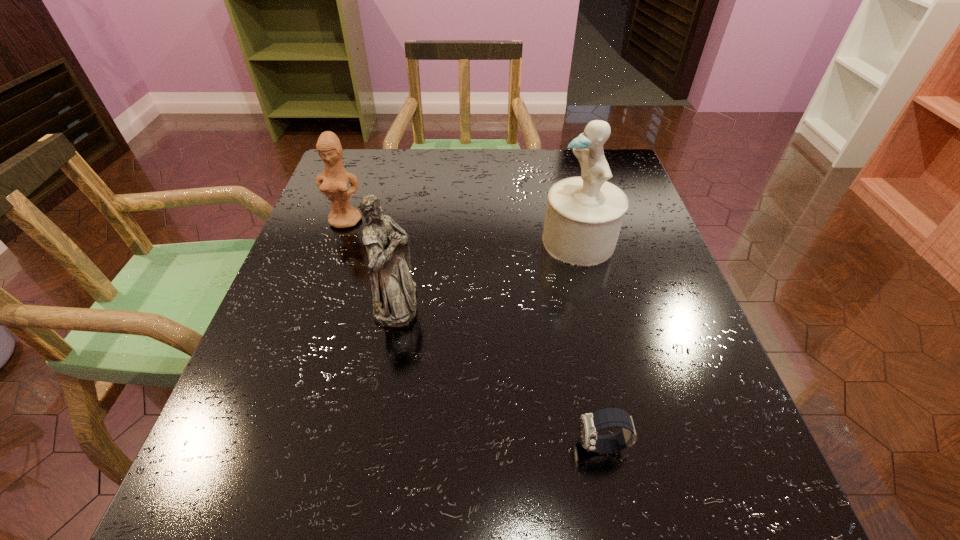
Image resolution: width=960 pixels, height=540 pixels. Identify the location of vacant space at the right edge. point(669,330).

The height and width of the screenshot is (540, 960). Identify the location of free space at the far left corner of the desktop. (360, 158).

This screenshot has height=540, width=960. Identify the location of vacant position at the near left corner of the desktop. (189, 535).

Identify the location of free space at the far right corner of the desktop. (633, 191).

You are a GUI agent. You are given a task and a screenshot of the screen. Output one action in this format:
    pyautogui.click(x=<x>, y=<y>)
    Task: Click on the free space between the shortest object and the leftmost figurine
    The width and height of the screenshot is (960, 540).
    Given the screenshot: What is the action you would take?
    pyautogui.click(x=474, y=333)

Where is `vacant point located between the nearest figurine and the tallest object`? Image resolution: width=960 pixels, height=540 pixels. vacant point located between the nearest figurine and the tallest object is located at coordinates (488, 272).

The image size is (960, 540). In order to click on free point between the tallest object and the leftmost object in this screenshot , I will do `click(463, 231)`.

Image resolution: width=960 pixels, height=540 pixels. What are the coordinates of `vacant area between the tallest object and the leftmost figurine` in the screenshot? It's located at (463, 231).

Identify the location of free point between the second figurine from right to left and the nearest object. (499, 374).

This screenshot has height=540, width=960. What are the coordinates of `vacant space in between the nearest figurine and the shortest object` in the screenshot? It's located at point(499,374).